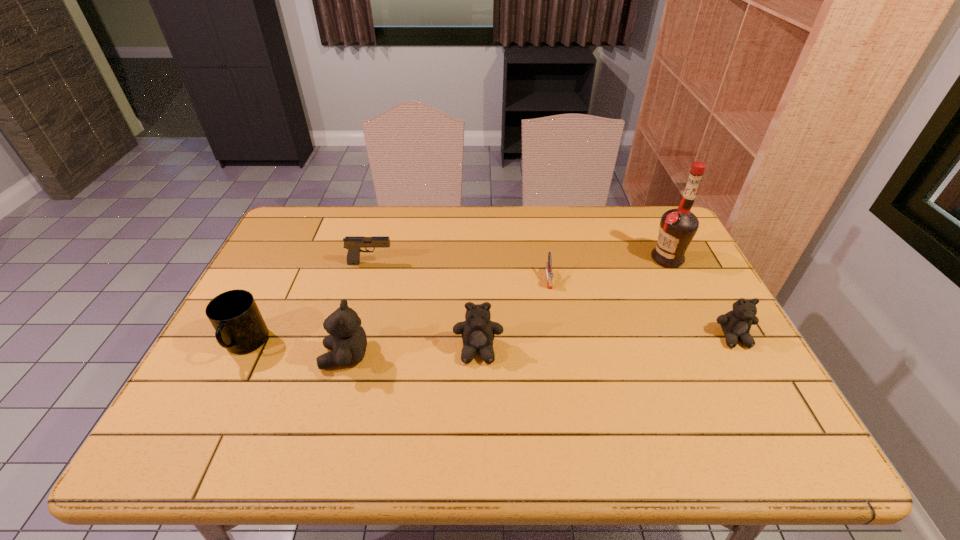
In order to click on object present at the near edge in this screenshot , I will do point(347,341).

Identify the location of object positioned at the left edge. The image size is (960, 540). (239, 327).

Find the location of `teddy bear present at the right edge`. teddy bear present at the right edge is located at coordinates (736, 324).

Where is `liquor at the right edge`? This screenshot has width=960, height=540. liquor at the right edge is located at coordinates (677, 228).

In the image, there is a desktop. In order to click on blank space at the far edge in this screenshot , I will do `click(499, 219)`.

This screenshot has width=960, height=540. In order to click on vacant space at the near edge in this screenshot , I will do `click(321, 388)`.

Locate an element on the screen. This screenshot has height=540, width=960. vacant region at the left edge is located at coordinates (300, 286).

Where is `vacant space at the right edge of the desktop`? The width and height of the screenshot is (960, 540). vacant space at the right edge of the desktop is located at coordinates pos(741,362).

Locate an element on the screen. This screenshot has width=960, height=540. free space at the far right corner is located at coordinates (626, 224).

The image size is (960, 540). I want to click on free space between the leftmost object and the pistol, so click(308, 303).